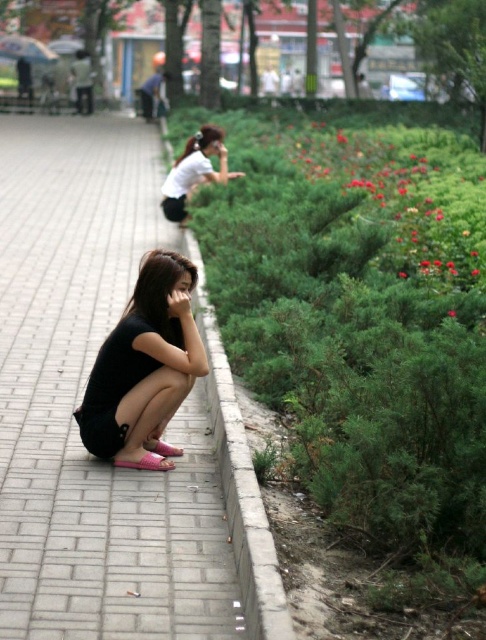
You are a drone operator trying to capture a photo of the gray concrete curb at lower center and the white matte shirt at upper center in the park scene. Your drone has a camera with a 50mm lens that can focus on objects within a range of 20 to 30 feet. Can the drone capture both objects in focus simultaneously?

The distance between the gray concrete curb at lower center and the white matte shirt at upper center is 22.27 feet, which falls within the 20 to 30 feet range of the drone camera. Therefore, the drone can capture both objects in focus simultaneously.

You are a gardener who needs to place a new decorative stone that is 10 cm in diameter. You have two options in the scene, the gray brick pavement at lower left and the red matte flower at upper right. Based on their sizes, which location would be more suitable for placing the stone without overcrowding the area?

The gray brick pavement at lower left has a larger size compared to the red matte flower at upper right, so placing the 10 cm decorative stone on the gray brick pavement at lower left would be more suitable as it has more space and is less likely to overcrowd the area.

You are a gardener planning to place a new decorative stone that is 1 meter wide. You see the gray concrete curb at lower center and the red matte flower at upper right. Which object can accommodate the stone if placed next to it without overlapping?

The gray concrete curb at lower center can accommodate the stone since its width is greater than the red matte flower at upper right, which is narrower and cannot fit the 1 meter wide stone.